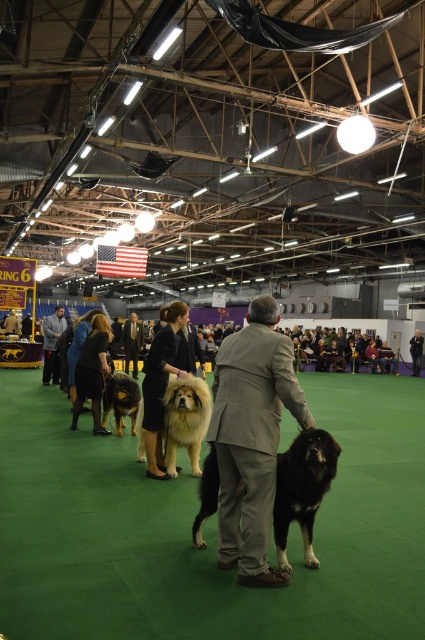
Question: Does golden brown fur at center appear on the left side of smooth brown coat at center?

Choices:
 (A) yes
 (B) no

Answer: (B)

Question: Does black wool coat at center have a greater width compared to smooth brown coat at center?

Choices:
 (A) no
 (B) yes

Answer: (A)

Question: Which point is farther from the camera taking this photo?

Choices:
 (A) (201, 516)
 (B) (135, 426)
 (C) (241, 561)
 (D) (170, 344)

Answer: (B)

Question: Does gray suit at center have a greater width compared to black fur dog at center?

Choices:
 (A) no
 (B) yes

Answer: (B)

Question: Which of the following is the farthest from the observer?

Choices:
 (A) coord(50,376)
 (B) coord(206,481)
 (C) coord(133,388)
 (D) coord(197,461)

Answer: (A)

Question: Which point is farther to the camera?

Choices:
 (A) gray suit at center
 (B) dark gray suit at center
 (C) black wool coat at center

Answer: (B)